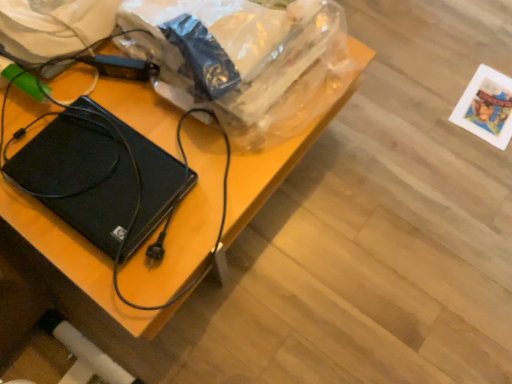
Locate an element on the screen. Image resolution: width=512 pixels, height=384 pixels. vacant region under black matte laptop at left (from a real-world perspective) is located at coordinates (104, 182).